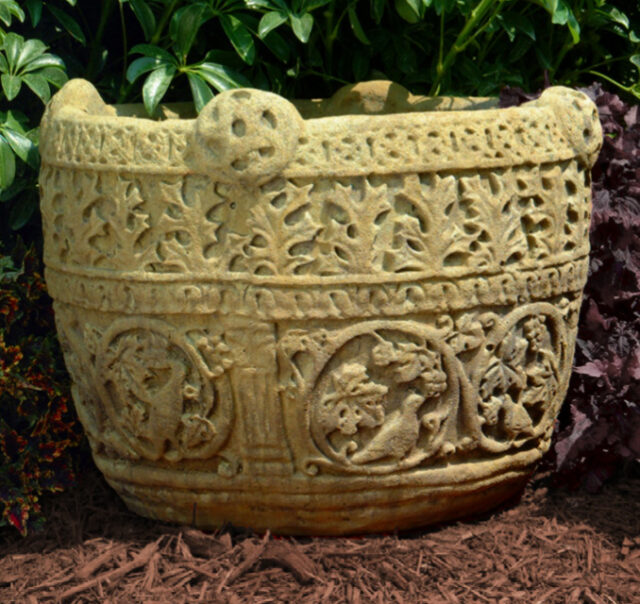
Where is `shadow on plant container`? The width and height of the screenshot is (640, 604). shadow on plant container is located at coordinates (322, 112), (132, 107), (399, 94).